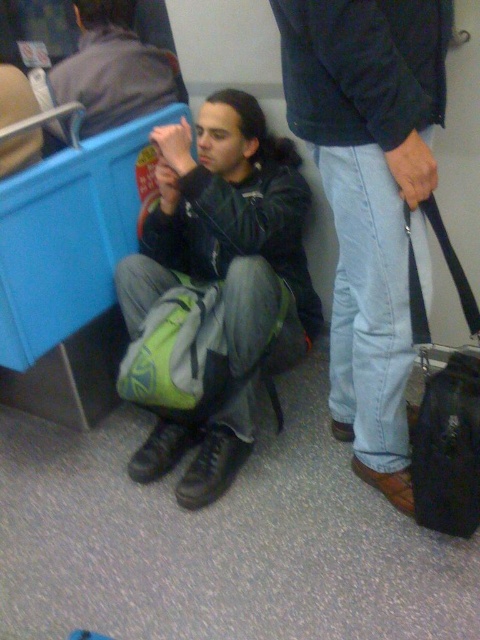
Which is behind, point (240, 141) or point (96, 51)?

The point (96, 51) is behind.

Can you confirm if black matte jacket at center is wider than matte black jacket at center?

Correct, the width of black matte jacket at center exceeds that of matte black jacket at center.

Which is in front, point (276, 250) or point (113, 60)?

Positioned in front is point (276, 250).

This screenshot has height=640, width=480. Find the location of `black matte jacket at center`. black matte jacket at center is located at coordinates (224, 275).

Can you confirm if light blue denim jeans at lower right is bigger than matte black jacket at center?

Correct, light blue denim jeans at lower right is larger in size than matte black jacket at center.

Which is above, light blue denim jeans at lower right or matte black jacket at center?

matte black jacket at center

You are a GUI agent. You are given a task and a screenshot of the screen. Output one action in this format:
    pyautogui.click(x=<x>, y=<y>)
    Task: Click on the light blue denim jeans at lower right
    
    Given the screenshot: What is the action you would take?
    pyautogui.click(x=370, y=196)

Between black matte jacket at center and green fabric backpack at center, which one is positioned lower?

green fabric backpack at center

Image resolution: width=480 pixels, height=640 pixels. I want to click on black matte jacket at center, so click(224, 275).